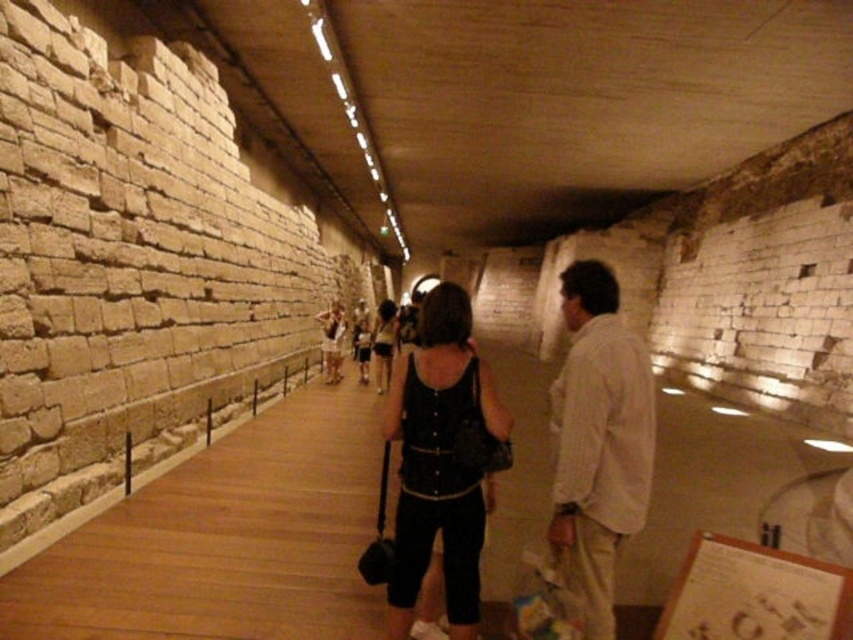
Question: Which of the following is the farthest from the observer?

Choices:
 (A) black leather tank top at center
 (B) white striped shirt at center
 (C) matte black tank top at center

Answer: (C)

Question: Can you confirm if white striped shirt at center is wider than matte black tank top at center?

Choices:
 (A) yes
 (B) no

Answer: (B)

Question: Among these objects, which one is nearest to the camera?

Choices:
 (A) black leather tank top at center
 (B) white striped shirt at center

Answer: (B)

Question: Can you confirm if black leather tank top at center is positioned to the left of dark gray fabric dress at center?

Choices:
 (A) yes
 (B) no

Answer: (B)

Question: Is black leather tank top at center thinner than matte black tank top at center?

Choices:
 (A) yes
 (B) no

Answer: (A)

Question: Which object is farther from the camera taking this photo?

Choices:
 (A) dark gray fabric dress at center
 (B) white striped shirt at center
 (C) matte black tank top at center
 (D) black leather tank top at center

Answer: (A)